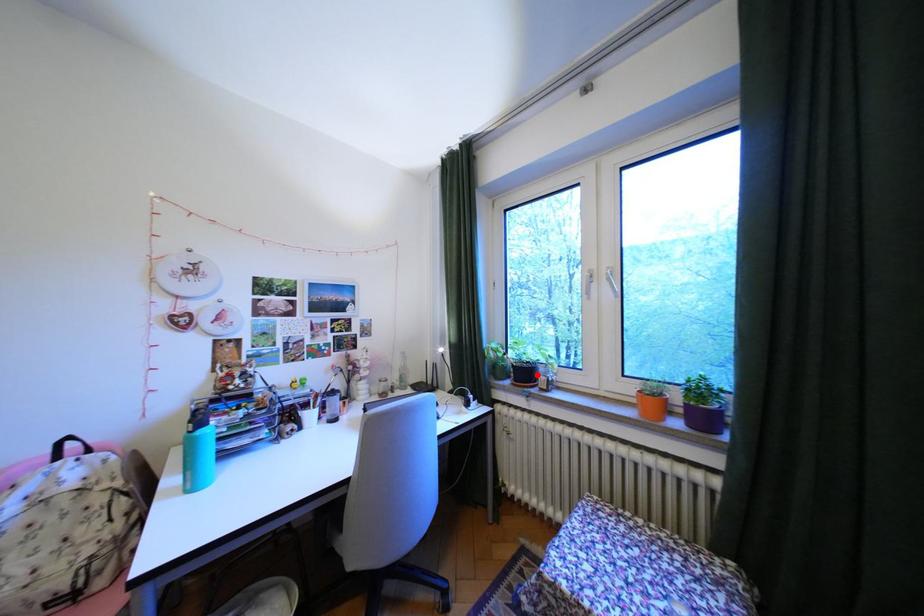
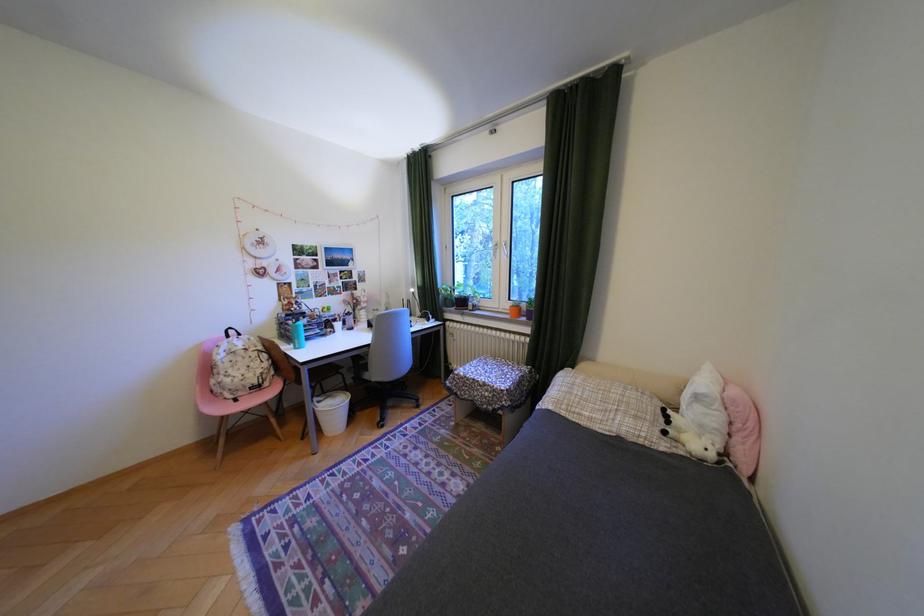
The point at the highlighted location is marked in the first image. Where is the corresponding point in the second image?

(475, 302)